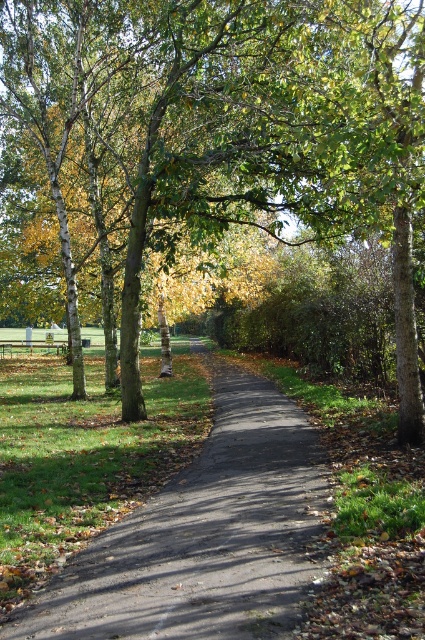
You are a gardener with a 2.5 meter wide lawn mower. You need to mow the grass on both sides of the black asphalt path at center. Can you maneuver the lawn mower between the path and the wooden park bench at center without hitting either?

The black asphalt path at center has a lesser width compared to wooden park bench at center, so the path is narrower than the bench. Since the lawn mower is 2.5 meters wide, it depends on the actual width of the path. However, since the path is narrower than the bench, if the bench is wider than 2.5 meters, the mower can fit, but if not, it might not. The information provided does not specify exact measurements, so we cannot definitively answer.

You are standing on the paved pathway in the park and want to walk towards the point labeled point (17,620). There is an obstacle at point labeled point (142,92). Will you encounter this obstacle before reaching your destination?

Point (142,92) is further to the viewer than point (17,620). Therefore, you will encounter the obstacle at point (142,92) before reaching your destination at point (17,620).

Looking at this image, you are a park visitor standing at the entrance of the paved pathway. You see the brown smooth tree at center and the wooden park bench at center. Which object is positioned higher relative to the other?

The brown smooth tree at center is located above the wooden park bench at center, so the tree is higher than the bench.